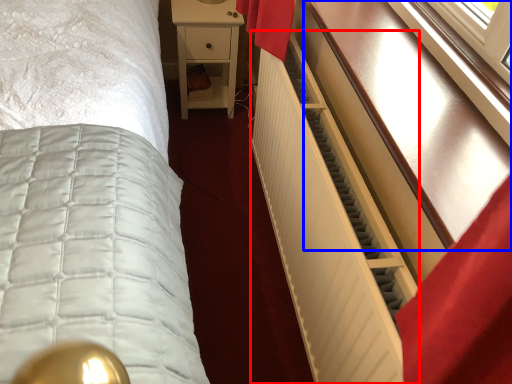
Question: Among these objects, which one is farthest to the camera, radiator (highlighted by a red box) or vanity (highlighted by a blue box)?

Choices:
 (A) radiator
 (B) vanity

Answer: (A)